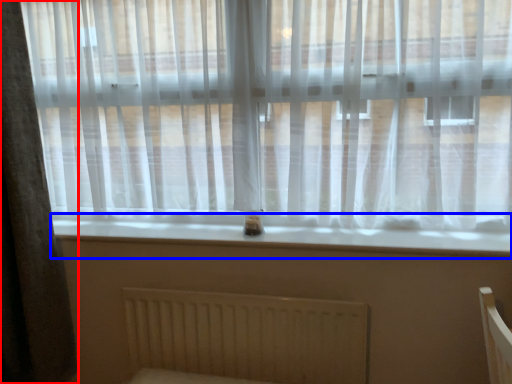
Question: Which object appears closest to the camera in this image, curtain (highlighted by a red box) or window sill (highlighted by a blue box)?

Choices:
 (A) curtain
 (B) window sill

Answer: (A)